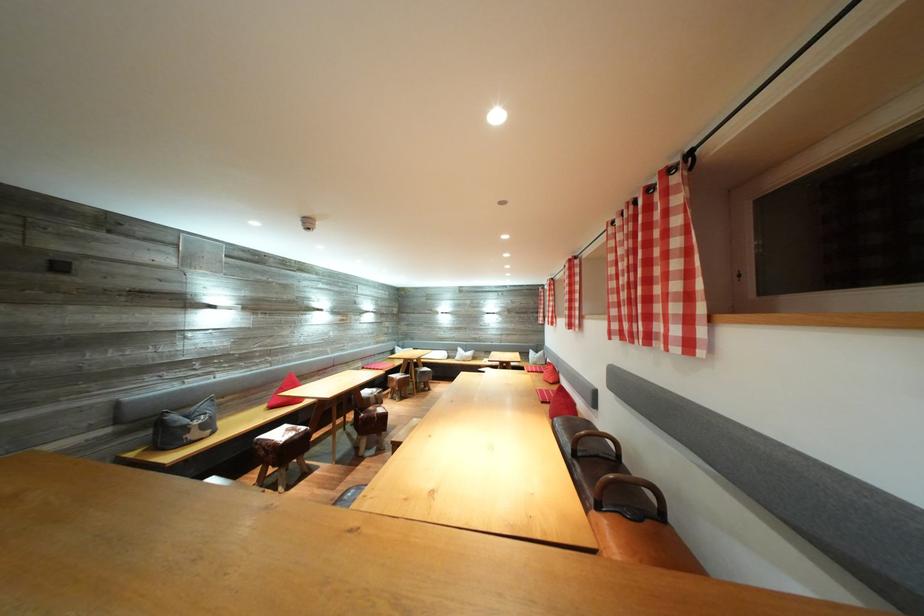
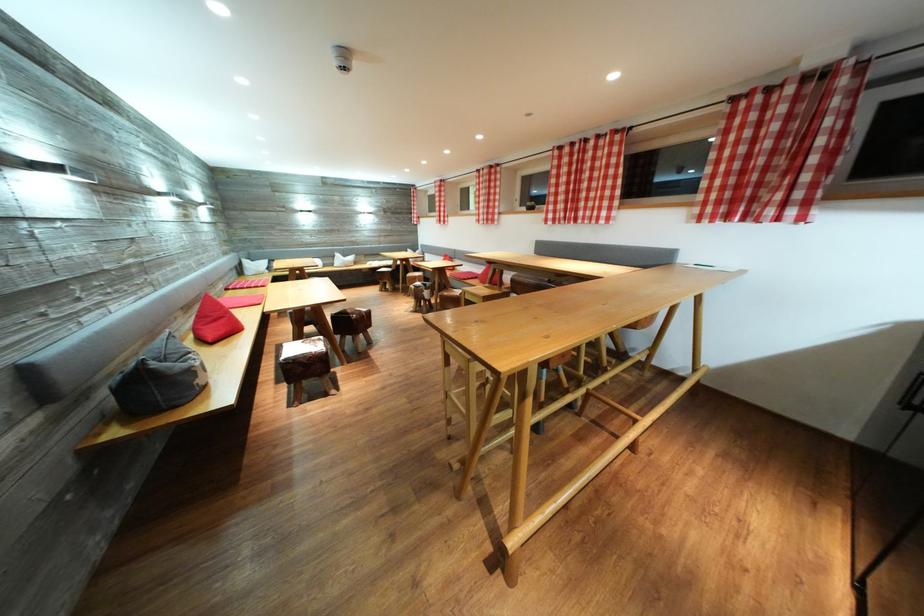
Find the pixel in the second image that matches pixel 622 331 in the first image.

(556, 222)